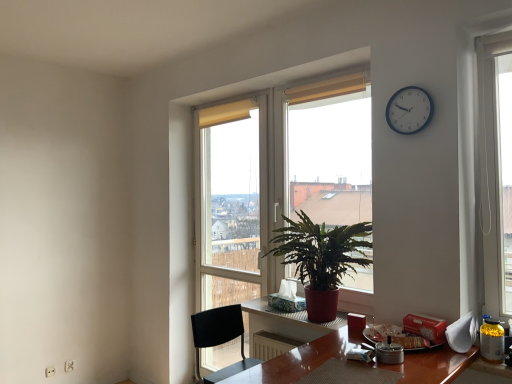
Question: Is green leafy plant at center smaller than transparent glass door at center?

Choices:
 (A) no
 (B) yes

Answer: (B)

Question: From a real-world perspective, is green leafy plant at center positioned under transparent glass door at center based on gravity?

Choices:
 (A) no
 (B) yes

Answer: (A)

Question: Considering the relative sizes of green leafy plant at center and transparent glass door at center in the image provided, is green leafy plant at center bigger than transparent glass door at center?

Choices:
 (A) yes
 (B) no

Answer: (B)

Question: Is green leafy plant at center turned away from transparent glass door at center?

Choices:
 (A) yes
 (B) no

Answer: (B)

Question: Considering the relative sizes of green leafy plant at center and transparent glass door at center in the image provided, is green leafy plant at center thinner than transparent glass door at center?

Choices:
 (A) yes
 (B) no

Answer: (A)

Question: Considering the relative sizes of green leafy plant at center and transparent glass door at center in the image provided, is green leafy plant at center shorter than transparent glass door at center?

Choices:
 (A) no
 (B) yes

Answer: (B)

Question: Is green glossy plant at center aimed at black plastic chair at lower center?

Choices:
 (A) no
 (B) yes

Answer: (A)

Question: From a real-world perspective, is green glossy plant at center on top of black plastic chair at lower center?

Choices:
 (A) yes
 (B) no

Answer: (A)

Question: Is green glossy plant at center shorter than black plastic chair at lower center?

Choices:
 (A) no
 (B) yes

Answer: (A)

Question: From the image's perspective, is green glossy plant at center located beneath black plastic chair at lower center?

Choices:
 (A) no
 (B) yes

Answer: (A)

Question: Is green glossy plant at center behind black plastic chair at lower center?

Choices:
 (A) no
 (B) yes

Answer: (B)

Question: Is the depth of green glossy plant at center less than that of black plastic chair at lower center?

Choices:
 (A) no
 (B) yes

Answer: (A)

Question: Is green leafy plant at center not within black plastic chair at lower center?

Choices:
 (A) no
 (B) yes

Answer: (B)